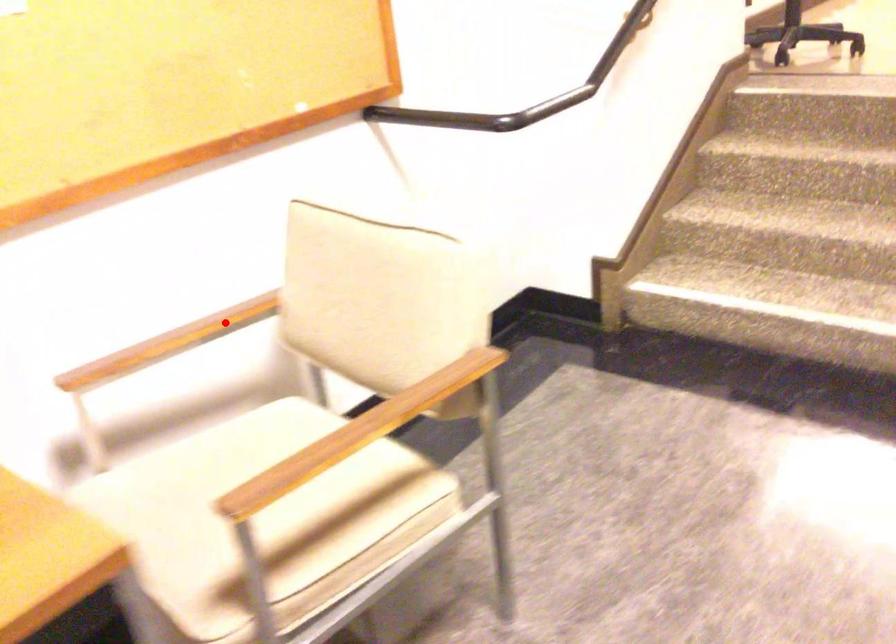
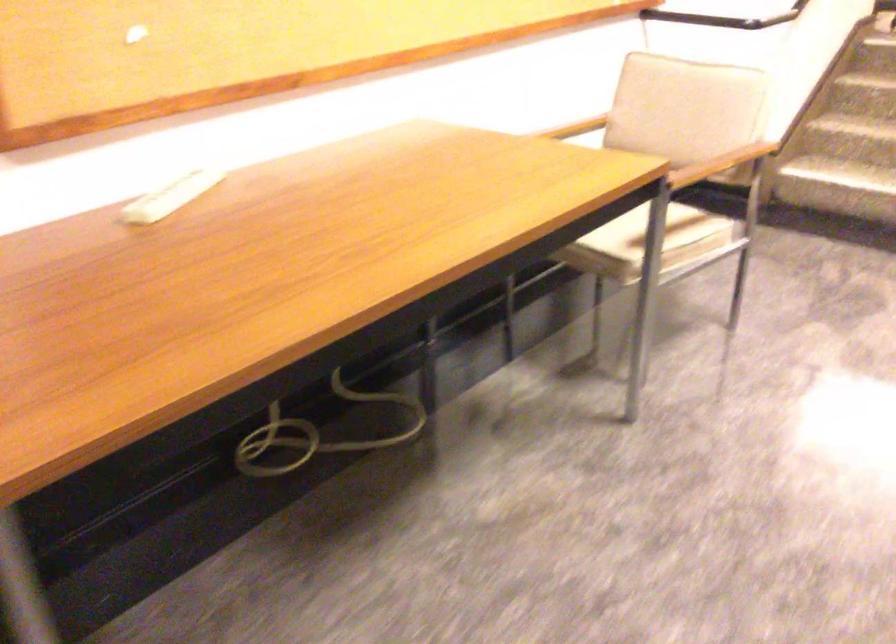
Question: I am providing you with two images of the same scene from different viewpoints. A red point is marked on the first image. Is the red point's position out of view in image 2?

Choices:
 (A) Yes
 (B) No

Answer: (B)